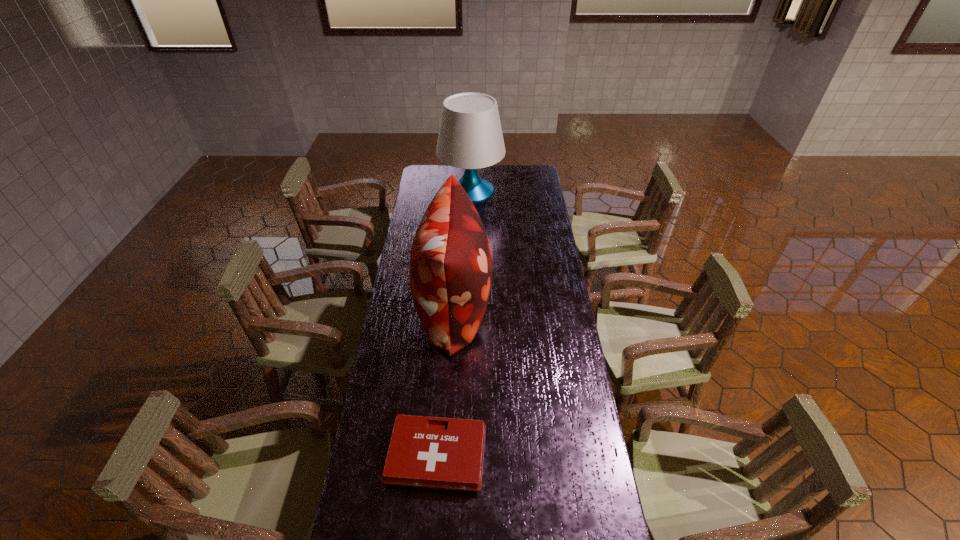
You are a GUI agent. You are given a task and a screenshot of the screen. Output one action in this format:
    pyautogui.click(x=<x>, y=<y>)
    Task: Click on the first-aid kit that is at the left edge
    The image size is (960, 540).
    Given the screenshot: What is the action you would take?
    pyautogui.click(x=433, y=452)

Identify the location of object that is at the far left corner. The height and width of the screenshot is (540, 960). (470, 136).

In the image, there is a desktop. Where is `vacant area at the far edge`? Image resolution: width=960 pixels, height=540 pixels. vacant area at the far edge is located at coordinates (450, 172).

I want to click on vacant space at the left edge of the desktop, so tap(416, 192).

The width and height of the screenshot is (960, 540). Identify the location of free space at the right edge. (544, 272).

Image resolution: width=960 pixels, height=540 pixels. In order to click on free space that is in between the cushion and the shortest object in this screenshot , I will do `click(445, 381)`.

I want to click on unoccupied area between the first-aid kit and the second farthest object, so click(x=445, y=381).

You are a GUI agent. You are given a task and a screenshot of the screen. Output one action in this format:
    pyautogui.click(x=<x>, y=<y>)
    Task: Click on the blank region between the cushion and the shortest object
    Image resolution: width=960 pixels, height=540 pixels.
    Given the screenshot: What is the action you would take?
    pyautogui.click(x=445, y=381)

Locate an element on the screen. The width and height of the screenshot is (960, 540). vacant area between the second nearest object and the nearest object is located at coordinates (445, 381).

Find the location of `the closest object to the first-aid kit`. the closest object to the first-aid kit is located at coordinates (450, 269).